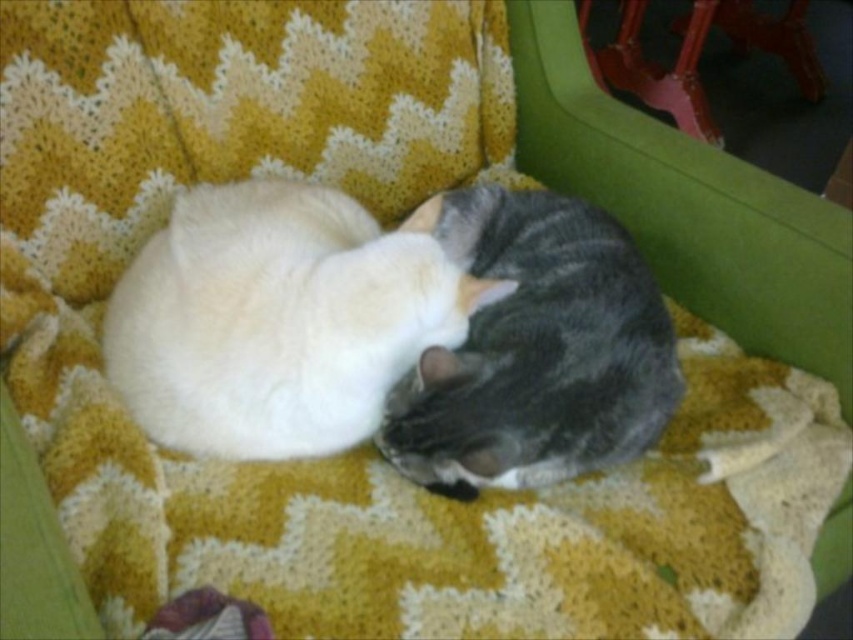
Is white soft fur cat at center shorter than gray striped cat at center?

Correct, white soft fur cat at center is not as tall as gray striped cat at center.

Is white soft fur cat at center further to camera compared to gray striped cat at center?

Yes, it is.

Between point (180, 353) and point (619, 253), which one is positioned in front?

Positioned in front is point (180, 353).

Find the location of a particular element. white soft fur cat at center is located at coordinates (277, 320).